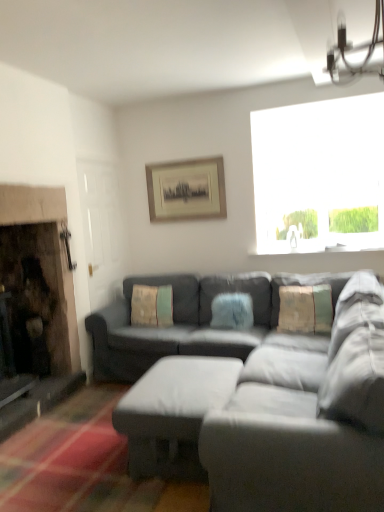
Question: In which direction should I rotate to look at fuzzy blue pillow at center, which is the second pillow in left-to-right order?

Choices:
 (A) right
 (B) left

Answer: (A)

Question: Could you tell me if textured beige pillow at center, placed as the third pillow when sorted from left to right, is turned towards matte gray couch at center?

Choices:
 (A) no
 (B) yes

Answer: (B)

Question: Is textured beige pillow at center, placed as the third pillow when sorted from left to right, positioned in front of matte gray couch at center?

Choices:
 (A) yes
 (B) no

Answer: (B)

Question: Is textured beige pillow at center, placed as the third pillow when sorted from left to right, at the left side of matte gray couch at center?

Choices:
 (A) no
 (B) yes

Answer: (A)

Question: Is textured beige pillow at center, which appears as the 1th pillow when viewed from the right, shorter than matte gray couch at center?

Choices:
 (A) no
 (B) yes

Answer: (B)

Question: From the image's perspective, would you say textured beige pillow at center, which appears as the 1th pillow when viewed from the right, is positioned over matte gray couch at center?

Choices:
 (A) yes
 (B) no

Answer: (A)

Question: Is textured beige pillow at center, which appears as the 1th pillow when viewed from the right, taller than matte gray couch at center?

Choices:
 (A) no
 (B) yes

Answer: (A)

Question: Considering the relative sizes of white plastic light fixture at upper right and matte black picture frame at upper center in the image provided, is white plastic light fixture at upper right smaller than matte black picture frame at upper center?

Choices:
 (A) yes
 (B) no

Answer: (B)

Question: Can you confirm if white plastic light fixture at upper right is positioned to the left of matte black picture frame at upper center?

Choices:
 (A) yes
 (B) no

Answer: (B)

Question: Does white plastic light fixture at upper right have a lesser width compared to matte black picture frame at upper center?

Choices:
 (A) yes
 (B) no

Answer: (B)

Question: Is there a large distance between white plastic light fixture at upper right and matte black picture frame at upper center?

Choices:
 (A) no
 (B) yes

Answer: (B)

Question: Is white plastic light fixture at upper right looking in the opposite direction of matte black picture frame at upper center?

Choices:
 (A) yes
 (B) no

Answer: (B)

Question: Considering the relative sizes of white plastic light fixture at upper right and matte black picture frame at upper center in the image provided, is white plastic light fixture at upper right wider than matte black picture frame at upper center?

Choices:
 (A) no
 (B) yes

Answer: (B)

Question: From a real-world perspective, is textured beige pillow at center, arranged as the first pillow when viewed from the left, physically below matte gray ottoman at center?

Choices:
 (A) yes
 (B) no

Answer: (B)